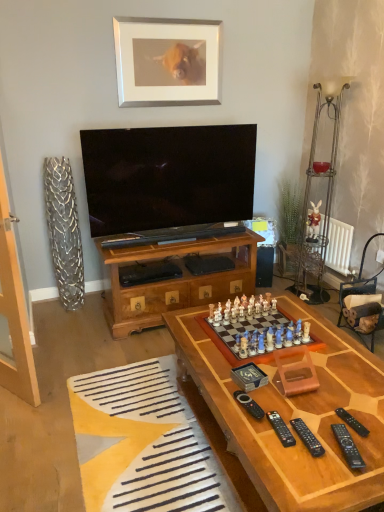
At what (x,y) coordinates should I click in order to perform the action: click on vacant space that is in between black plastic remote at lower right, which ranks as the 3th remote in right-to-left order, and black plastic remote at center, which ranks as the 5th remote in right-to-left order. Please return your answer as a coordinate pair (x, y). Image resolution: width=384 pixels, height=512 pixels. Looking at the image, I should click on (274, 420).